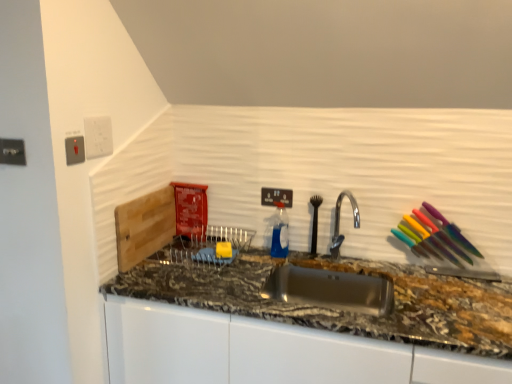
Where is `blank space situated above granite at center (from a real-world perspective)`? The height and width of the screenshot is (384, 512). blank space situated above granite at center (from a real-world perspective) is located at coordinates (285, 251).